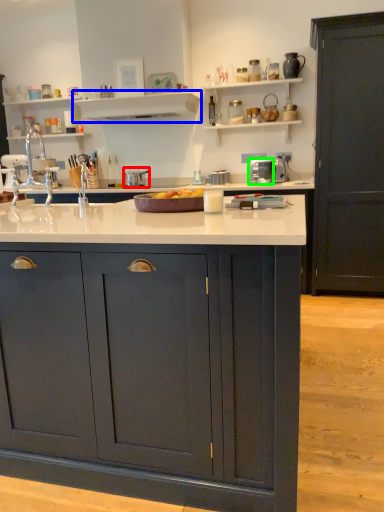
Question: Considering the real-world distances, which object is farthest from appliance (highlighted by a red box)? shelf (highlighted by a blue box) or appliance (highlighted by a green box)?

Choices:
 (A) shelf
 (B) appliance

Answer: (B)